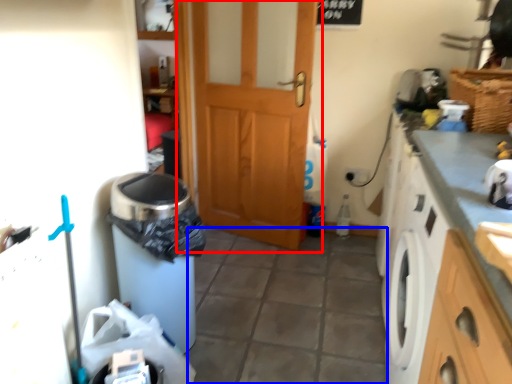
Question: Which of the following is the farthest to the observer, door (highlighted by a red box) or tile (highlighted by a blue box)?

Choices:
 (A) door
 (B) tile

Answer: (A)